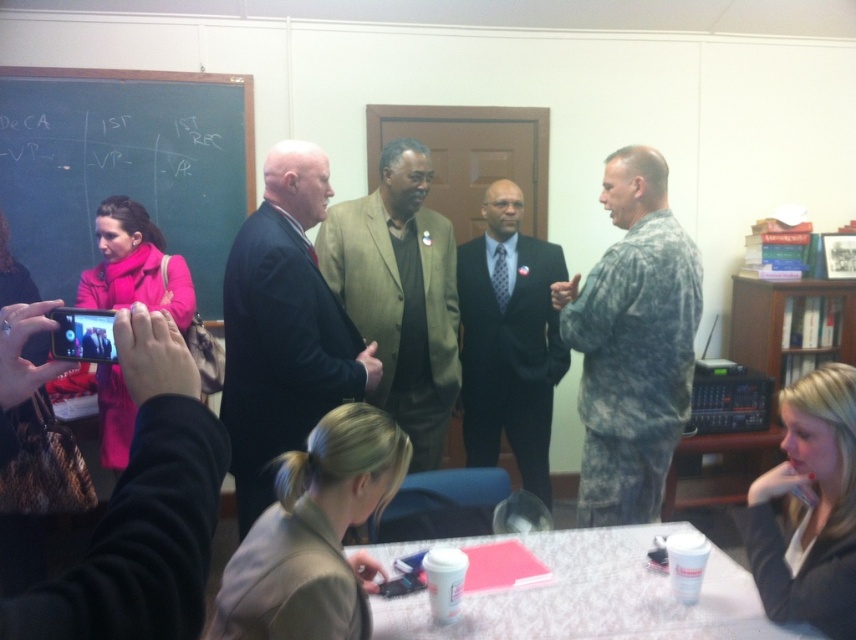
Between dark suit at center and blonde hair at lower right, which one has more height?

Standing taller between the two is dark suit at center.

How far apart are dark suit at center and blonde hair at lower right?

dark suit at center is 4.14 feet from blonde hair at lower right.

This screenshot has height=640, width=856. Identify the location of dark suit at center. (283, 328).

The width and height of the screenshot is (856, 640). What are the coordinates of `dark suit at center` in the screenshot? It's located at (283, 328).

Who is lower down, light brown leather jacket at lower center or black suit at center?

light brown leather jacket at lower center is below.

This screenshot has width=856, height=640. I want to click on light brown leather jacket at lower center, so click(x=314, y=534).

Identify the location of light brown leather jacket at lower center. pyautogui.click(x=314, y=534).

Is light brown suit at center positioned before blonde hair at lower right?

That is False.

Between light brown suit at center and blonde hair at lower right, which one appears on the right side from the viewer's perspective?

blonde hair at lower right

Which is in front, point (418, 444) or point (783, 577)?

Point (783, 577) is more forward.

At what (x,y) coordinates should I click in order to perform the action: click on light brown suit at center. Please return your answer as a coordinate pair (x, y). This screenshot has height=640, width=856. Looking at the image, I should click on (400, 292).